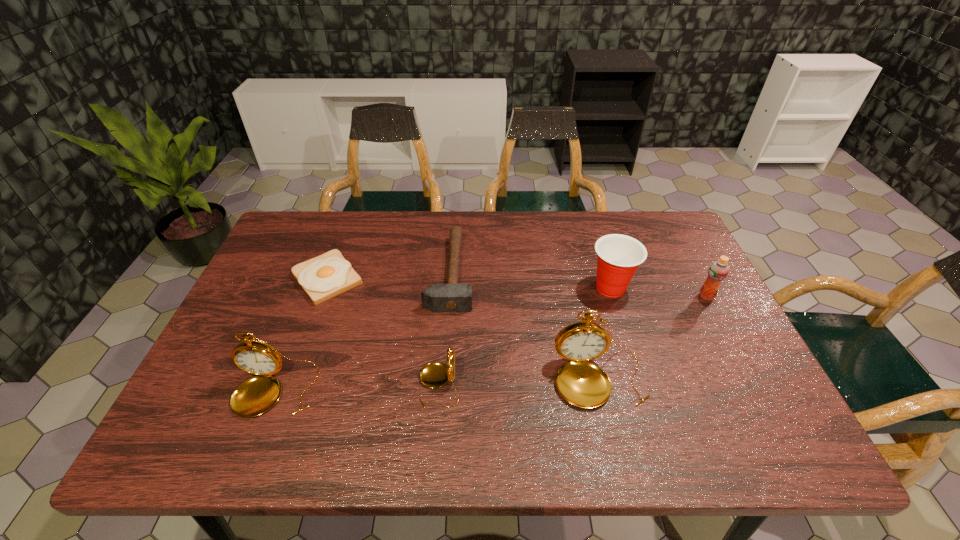
I want to click on the leftmost pocket watch, so click(x=256, y=395).

This screenshot has width=960, height=540. Identify the location of the second pocket watch from left to right. (435, 374).

Find the location of a particular element. the third shortest object is located at coordinates (435, 374).

Find the location of `the rightmost pocket watch`. the rightmost pocket watch is located at coordinates (583, 384).

At what (x,y) coordinates should I click in order to perform the action: click on the shortest object. Please return your answer as a coordinate pair (x, y). Looking at the image, I should click on pyautogui.click(x=328, y=275).

Locate an element on the screen. This screenshot has width=960, height=540. hammer is located at coordinates (452, 297).

You are a GUI agent. You are given a task and a screenshot of the screen. Output one action in this format:
    pyautogui.click(x=<x>, y=<y>)
    Task: Click on the cup
    Image resolution: width=960 pixels, height=540 pixels.
    Given the screenshot: What is the action you would take?
    pyautogui.click(x=618, y=256)

This screenshot has height=540, width=960. In order to click on orange juice in this screenshot , I will do `click(718, 270)`.

Where is `free space located 0.160m on the face of the fifth tallest object`? The height and width of the screenshot is (540, 960). free space located 0.160m on the face of the fifth tallest object is located at coordinates 349,384.

The height and width of the screenshot is (540, 960). I want to click on vacant space located on the face of the fifth tallest object, so click(x=384, y=384).